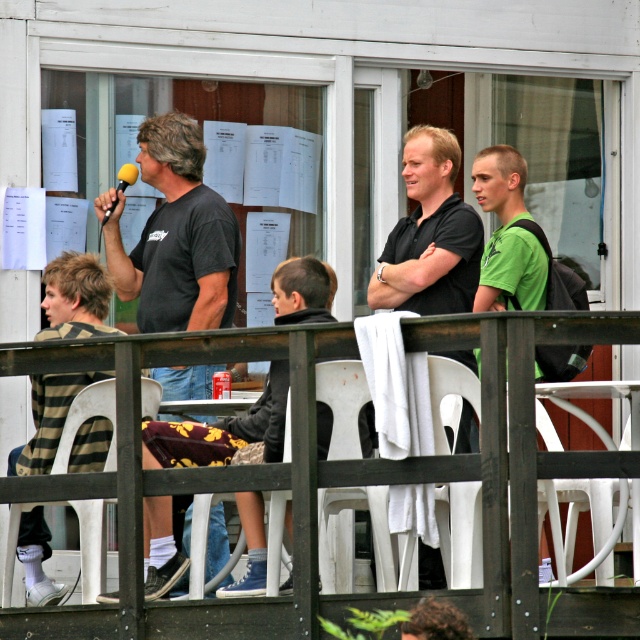
You are standing at the point marked as point (353, 538). You want to sit down on the white plastic chair at center. Is the chair directly in front of you?

The white plastic chair at center is located at point (353, 538), so yes, the chair is directly in front of you at that point.